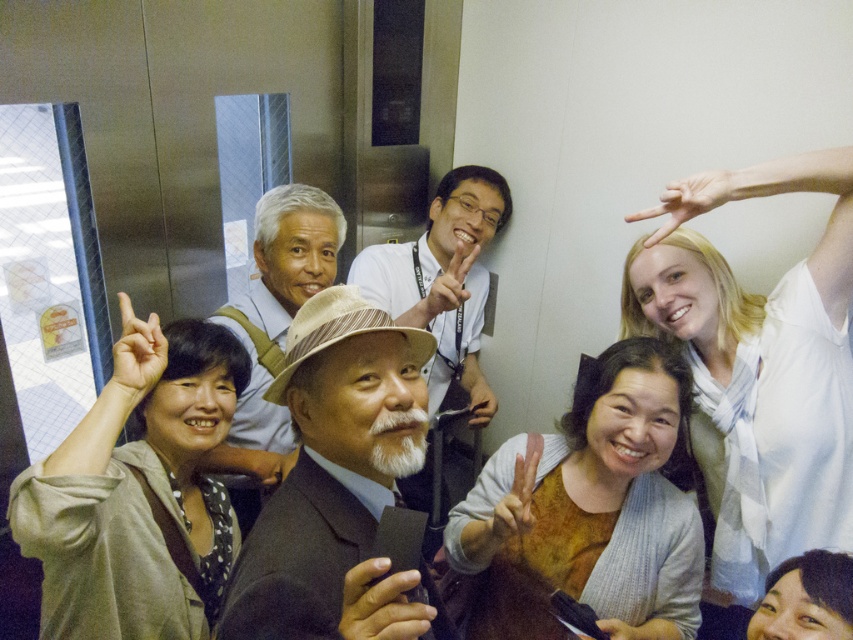
Identify the location of light brown fabric hat at center. The image size is (853, 640). (343, 460).

Is light brown fabric hat at center taller than white beard at center?

No.

This screenshot has width=853, height=640. I want to click on light brown fabric hat at center, so click(x=343, y=460).

Consider the image. Can you confirm if white cotton shirt at upper right is bigger than light brown fabric hat at center?

Correct, white cotton shirt at upper right is larger in size than light brown fabric hat at center.

Between white cotton shirt at upper right and light brown fabric hat at center, which one has more height?

Standing taller between the two is white cotton shirt at upper right.

The width and height of the screenshot is (853, 640). What do you see at coordinates (757, 371) in the screenshot?
I see `white cotton shirt at upper right` at bounding box center [757, 371].

The width and height of the screenshot is (853, 640). Find the location of `white cotton shirt at upper right`. white cotton shirt at upper right is located at coordinates (757, 371).

Does white cotton shirt at upper right have a lesser height compared to light brown textured hat at center?

In fact, white cotton shirt at upper right may be taller than light brown textured hat at center.

Between white cotton shirt at upper right and light brown textured hat at center, which one appears on the right side from the viewer's perspective?

From the viewer's perspective, white cotton shirt at upper right appears more on the right side.

You are a GUI agent. You are given a task and a screenshot of the screen. Output one action in this format:
    pyautogui.click(x=<x>, y=<y>)
    Task: Click on the white cotton shirt at upper right
    
    Given the screenshot: What is the action you would take?
    pyautogui.click(x=757, y=371)